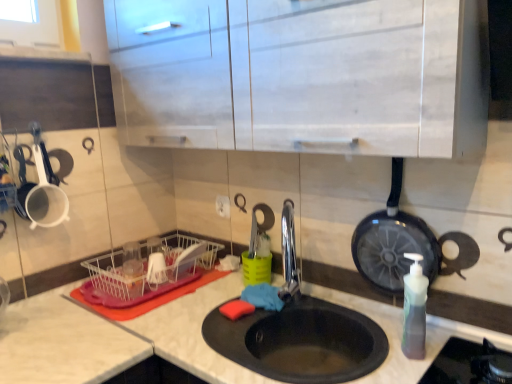
Question: Is black matte sink at center turned away from black non-stick frying pan at right?

Choices:
 (A) no
 (B) yes

Answer: (A)

Question: From a real-world perspective, is black matte sink at center positioned under black non-stick frying pan at right based on gravity?

Choices:
 (A) yes
 (B) no

Answer: (A)

Question: Does black matte sink at center have a lesser height compared to black non-stick frying pan at right?

Choices:
 (A) no
 (B) yes

Answer: (B)

Question: Considering the relative positions of black matte sink at center and black non-stick frying pan at right in the image provided, is black matte sink at center to the right of black non-stick frying pan at right from the viewer's perspective?

Choices:
 (A) no
 (B) yes

Answer: (A)

Question: Can you see black matte sink at center touching black non-stick frying pan at right?

Choices:
 (A) no
 (B) yes

Answer: (A)

Question: Is black matte sink at center surrounding black non-stick frying pan at right?

Choices:
 (A) yes
 (B) no

Answer: (B)

Question: Does black non-stick frying pan at right have a larger size compared to clear plastic dish rack at lower left?

Choices:
 (A) yes
 (B) no

Answer: (B)

Question: Is the position of black non-stick frying pan at right more distant than that of clear plastic dish rack at lower left?

Choices:
 (A) yes
 (B) no

Answer: (B)

Question: From a real-world perspective, is black non-stick frying pan at right on top of clear plastic dish rack at lower left?

Choices:
 (A) no
 (B) yes

Answer: (B)

Question: Is black non-stick frying pan at right wider than clear plastic dish rack at lower left?

Choices:
 (A) yes
 (B) no

Answer: (B)

Question: Is black non-stick frying pan at right taller than clear plastic dish rack at lower left?

Choices:
 (A) no
 (B) yes

Answer: (B)

Question: Is black non-stick frying pan at right oriented away from clear plastic dish rack at lower left?

Choices:
 (A) yes
 (B) no

Answer: (B)

Question: Is black non-stick frying pan at right at the left side of black matte sink at center?

Choices:
 (A) no
 (B) yes

Answer: (A)